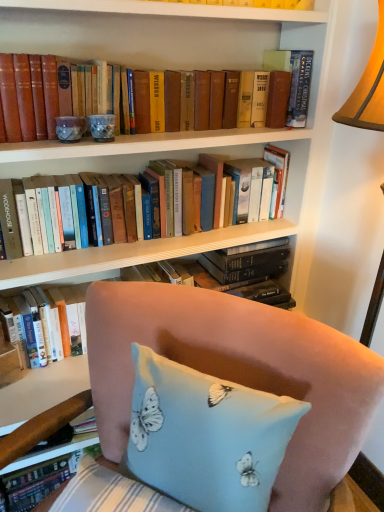
Locate an element on the screen. hardcover books at center, which is the 1th book in bottom-to-top order is located at coordinates (73, 219).

The image size is (384, 512). Identify the location of matte brown book at upper center, marked as the second book in a bottom-to-top arrangement. (31, 96).

From the picture: Can you tell me how much light blue fabric pillow with butterfly print at lower center and hardcover book at upper right, the 3th book ordered from the bottom, differ in facing direction?

The facing directions of light blue fabric pillow with butterfly print at lower center and hardcover book at upper right, the 3th book ordered from the bottom, are 50 degrees apart.

Is light blue fabric pillow with butterfly print at lower center aimed at hardcover book at upper right, acting as the 1th book starting from the top?

No.

Can you confirm if light blue fabric pillow with butterfly print at lower center is shorter than hardcover book at upper right, the 3th book ordered from the bottom?

No, light blue fabric pillow with butterfly print at lower center is not shorter than hardcover book at upper right, the 3th book ordered from the bottom.

Which object is further away from the camera, pink fabric chair at lower right or light blue fabric pillow with butterfly print at lower center?

Positioned behind is light blue fabric pillow with butterfly print at lower center.

Is pink fabric chair at lower right wider or thinner than light blue fabric pillow with butterfly print at lower center?

Clearly, pink fabric chair at lower right has more width compared to light blue fabric pillow with butterfly print at lower center.

Is pink fabric chair at lower right shorter than light blue fabric pillow with butterfly print at lower center?

No, pink fabric chair at lower right is not shorter than light blue fabric pillow with butterfly print at lower center.

From a real-world perspective, which is physically above, pink fabric chair at lower right or light blue fabric pillow with butterfly print at lower center?

Result: From a 3D spatial view, light blue fabric pillow with butterfly print at lower center is above.

Relative to hardcover books at center, marked as the 3th book in a top-to-bottom arrangement, is light blue fabric pillow with butterfly print at lower center in front or behind?

light blue fabric pillow with butterfly print at lower center is positioned closer to the viewer than hardcover books at center, marked as the 3th book in a top-to-bottom arrangement.

Between point (243, 405) and point (38, 226), which one is positioned in front?

The point (243, 405) is closer.

From the image's perspective, is light blue fabric pillow with butterfly print at lower center on top of hardcover books at center, which is the 1th book in bottom-to-top order?

No, from the image's perspective, light blue fabric pillow with butterfly print at lower center is not over hardcover books at center, which is the 1th book in bottom-to-top order.

From their relative heights in the image, would you say light blue fabric pillow with butterfly print at lower center is taller or shorter than hardcover books at center, marked as the 3th book in a top-to-bottom arrangement?

Clearly, light blue fabric pillow with butterfly print at lower center is taller compared to hardcover books at center, marked as the 3th book in a top-to-bottom arrangement.

Is the position of hardcover book at upper right, acting as the 1th book starting from the top, more distant than that of matte brown book at upper center, marked as the second book in a bottom-to-top arrangement?

That is True.

From a real-world perspective, starting from the hardcover book at upper right, the 3th book ordered from the bottom, which book is the 1st one below it? Please provide its 2D coordinates.

[(31, 96)]

From a real-world perspective, is hardcover book at upper right, acting as the 1th book starting from the top, under matte brown book at upper center, marked as the second book in a bottom-to-top arrangement?

No, from a real-world perspective, hardcover book at upper right, acting as the 1th book starting from the top, is not under matte brown book at upper center, marked as the second book in a bottom-to-top arrangement.

What's the angular difference between matte brown book at upper center, the 2th book positioned from the top, and light blue fabric pillow with butterfly print at lower center's facing directions?

matte brown book at upper center, the 2th book positioned from the top, and light blue fabric pillow with butterfly print at lower center are facing 50 degrees away from each other.

Choose the correct answer: Is matte brown book at upper center, the 2th book positioned from the top, inside light blue fabric pillow with butterfly print at lower center or outside it?

matte brown book at upper center, the 2th book positioned from the top, is outside light blue fabric pillow with butterfly print at lower center.

Which object is more forward, matte brown book at upper center, the 2th book positioned from the top, or light blue fabric pillow with butterfly print at lower center?

Result: light blue fabric pillow with butterfly print at lower center is closer to the camera.

Based on their sizes in the image, would you say matte brown book at upper center, the 2th book positioned from the top, is bigger or smaller than light blue fabric pillow with butterfly print at lower center?

matte brown book at upper center, the 2th book positioned from the top, is smaller than light blue fabric pillow with butterfly print at lower center.

Relative to hardcover book at upper right, the 3th book ordered from the bottom, is matte brown book at upper center, the 2th book positioned from the top, in front or behind?

matte brown book at upper center, the 2th book positioned from the top, is in front of hardcover book at upper right, the 3th book ordered from the bottom.

From the image's perspective, is matte brown book at upper center, marked as the second book in a bottom-to-top arrangement, above hardcover book at upper right, the 3th book ordered from the bottom?

No, from the image's perspective, matte brown book at upper center, marked as the second book in a bottom-to-top arrangement, is not over hardcover book at upper right, the 3th book ordered from the bottom.

Looking at this image, is hardcover book at upper right, the 3th book ordered from the bottom, at the back of matte brown book at upper center, the 2th book positioned from the top?

matte brown book at upper center, the 2th book positioned from the top, does not have its back to hardcover book at upper right, the 3th book ordered from the bottom.

Which of these two, hardcover books at center, which is the 1th book in bottom-to-top order, or pink fabric chair at lower right, is smaller?

With smaller size is hardcover books at center, which is the 1th book in bottom-to-top order.

Is hardcover books at center, which is the 1th book in bottom-to-top order, in front of or behind pink fabric chair at lower right in the image?

Clearly, hardcover books at center, which is the 1th book in bottom-to-top order, is behind pink fabric chair at lower right.

Is hardcover books at center, marked as the 3th book in a top-to-bottom arrangement, outside of pink fabric chair at lower right?

hardcover books at center, marked as the 3th book in a top-to-bottom arrangement, lies outside pink fabric chair at lower right's area.

The width and height of the screenshot is (384, 512). What are the coordinates of `pillow that is in front of the hardcover book at upper right, acting as the 1th book starting from the top` in the screenshot? It's located at (206, 435).

I want to click on pillow located above the pink fabric chair at lower right (from a real-world perspective), so click(x=206, y=435).

Looking at the image, which one is located further to light blue fabric pillow with butterfly print at lower center, hardcover book at upper right, the 3th book ordered from the bottom, or hardcover books at center, which is the 1th book in bottom-to-top order?

hardcover book at upper right, the 3th book ordered from the bottom, is further to light blue fabric pillow with butterfly print at lower center.

Considering their positions, is hardcover books at center, which is the 1th book in bottom-to-top order, positioned further to pink fabric chair at lower right than hardcover book at upper right, acting as the 1th book starting from the top?

The object further to pink fabric chair at lower right is hardcover book at upper right, acting as the 1th book starting from the top.

Looking at the image, which one is located further to matte brown book at upper center, the 2th book positioned from the top, hardcover book at upper right, the 3th book ordered from the bottom, or pink fabric chair at lower right?

pink fabric chair at lower right is positioned further to the anchor matte brown book at upper center, the 2th book positioned from the top.

Based on the photo, which object lies further to the anchor point light blue fabric pillow with butterfly print at lower center, hardcover books at center, which is the 1th book in bottom-to-top order, or pink fabric chair at lower right?

hardcover books at center, which is the 1th book in bottom-to-top order, is further to light blue fabric pillow with butterfly print at lower center.

Considering their positions, is hardcover books at center, which is the 1th book in bottom-to-top order, positioned closer to pink fabric chair at lower right than light blue fabric pillow with butterfly print at lower center?

Based on the image, hardcover books at center, which is the 1th book in bottom-to-top order, appears to be nearer to pink fabric chair at lower right.

In the scene shown: When comparing their distances from pink fabric chair at lower right, does matte brown book at upper center, the 2th book positioned from the top, or hardcover books at center, marked as the 3th book in a top-to-bottom arrangement, seem further?

matte brown book at upper center, the 2th book positioned from the top, is positioned further to the anchor pink fabric chair at lower right.

Looking at the image, which one is located closer to light blue fabric pillow with butterfly print at lower center, pink fabric chair at lower right or matte brown book at upper center, marked as the second book in a bottom-to-top arrangement?

Based on the image, pink fabric chair at lower right appears to be nearer to light blue fabric pillow with butterfly print at lower center.

Which object lies nearer to the anchor point hardcover books at center, marked as the 3th book in a top-to-bottom arrangement, hardcover book at upper right, the 3th book ordered from the bottom, or light blue fabric pillow with butterfly print at lower center?

Based on the image, hardcover book at upper right, the 3th book ordered from the bottom, appears to be nearer to hardcover books at center, marked as the 3th book in a top-to-bottom arrangement.

Identify the location of pillow between matte brown book at upper center, the 2th book positioned from the top, and pink fabric chair at lower right vertically. (206, 435).

Where is `book between matte brown book at upper center, the 2th book positioned from the top, and pink fabric chair at lower right in the up-down direction`? book between matte brown book at upper center, the 2th book positioned from the top, and pink fabric chair at lower right in the up-down direction is located at coordinates (73, 219).

Locate an element on the screen. The image size is (384, 512). book between hardcover books at center, marked as the 3th book in a top-to-bottom arrangement, and hardcover book at upper right, the 3th book ordered from the bottom, in the horizontal direction is located at coordinates (31, 96).

What are the coordinates of `pillow between hardcover books at center, which is the 1th book in bottom-to-top order, and pink fabric chair at lower right in the up-down direction` in the screenshot? It's located at (206, 435).